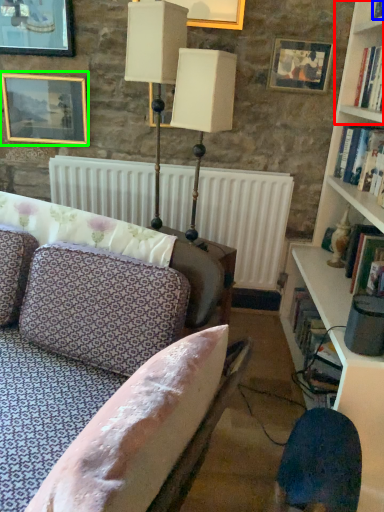
Question: Estimate the real-world distances between objects in this image. Which object is farther from shelf (highlighted by a red box), book (highlighted by a blue box) or picture frame (highlighted by a green box)?

Choices:
 (A) book
 (B) picture frame

Answer: (B)